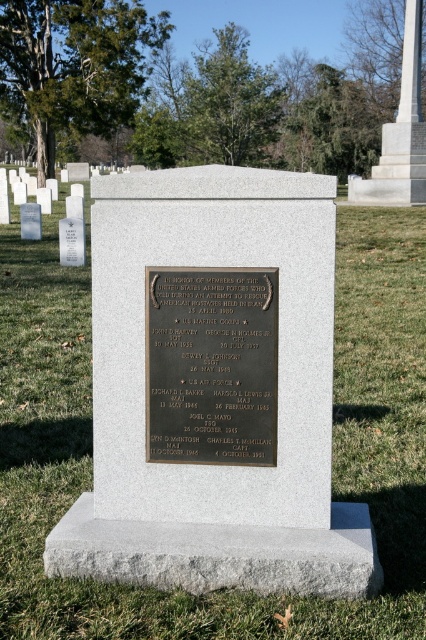
Is point (180, 483) less distant than point (399, 186)?

Yes, point (180, 483) is in front of point (399, 186).

Does point (192, 502) lie behind point (391, 124)?

That is False.

Does point (161, 516) come behind point (420, 8)?

No.

Where is `gray granite gravestone at center`? gray granite gravestone at center is located at coordinates (213, 388).

Is point (270, 573) behind point (195, 342)?

No, it is not.

Locate an element on the screen. gray granite gravestone at center is located at coordinates (213, 388).

Does bronze plaque at center have a larger size compared to white marble monument at upper right?

Incorrect, bronze plaque at center is not larger than white marble monument at upper right.

Between bronze plaque at center and white marble monument at upper right, which one has more height?

Standing taller between the two is white marble monument at upper right.

This screenshot has height=640, width=426. What do you see at coordinates (212, 365) in the screenshot?
I see `bronze plaque at center` at bounding box center [212, 365].

Identify the location of bronze plaque at center. (212, 365).